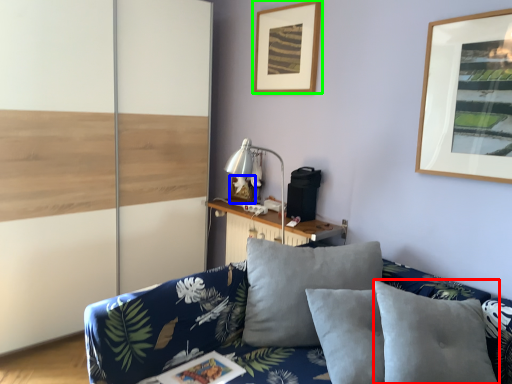
Question: Which object is positioned farthest from pillow (highlighted by a red box)? Select from picture frame (highlighted by a blue box) and picture frame (highlighted by a green box).

Choices:
 (A) picture frame
 (B) picture frame

Answer: (B)